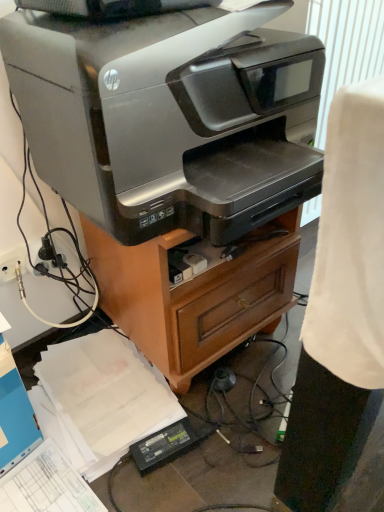
At what (x,y) coordinates should I click in order to perform the action: click on satin silver printer at center. Please return your answer as a coordinate pair (x, y). The height and width of the screenshot is (512, 384). Looking at the image, I should click on (169, 118).

This screenshot has height=512, width=384. What do you see at coordinates (51, 254) in the screenshot?
I see `black plastic plug at lower left` at bounding box center [51, 254].

What are the coordinates of `silver metallic printer at center` in the screenshot? It's located at (194, 295).

You are a GUI agent. You are given a task and a screenshot of the screen. Output one action in this format:
    pyautogui.click(x=<x>, y=<y>)
    Task: Click on the printer on the left of silver metallic printer at center
    
    Given the screenshot: What is the action you would take?
    pyautogui.click(x=169, y=118)

Which object is closer to the camera taking this photo, silver metallic printer at center or satin silver printer at center?

satin silver printer at center is closer to the camera.

In the scene shown: How distant is silver metallic printer at center from satin silver printer at center?

23.71 centimeters.

Considering the sizes of objects silver metallic printer at center and satin silver printer at center in the image provided, who is wider, silver metallic printer at center or satin silver printer at center?

satin silver printer at center.

In terms of height, does black plastic plug at lower left look taller or shorter compared to satin silver printer at center?

In the image, black plastic plug at lower left appears to be shorter than satin silver printer at center.

Is black plastic plug at lower left not close to satin silver printer at center?

black plastic plug at lower left is actually quite close to satin silver printer at center.

Does point (45, 240) come closer to viewer compared to point (163, 150)?

No, it is not.

From a real-world perspective, between black plastic plug at lower left and satin silver printer at center, who is vertically lower?

In real-world perspective, black plastic plug at lower left is lower.

From the image's perspective, which object appears higher, satin silver printer at center or silver metallic printer at center?

satin silver printer at center, from the image's perspective.

Considering the sizes of satin silver printer at center and silver metallic printer at center in the image, is satin silver printer at center taller or shorter than silver metallic printer at center?

Clearly, satin silver printer at center is shorter compared to silver metallic printer at center.

Which object is further away from the camera, satin silver printer at center or silver metallic printer at center?

silver metallic printer at center is behind.

What's the angular difference between satin silver printer at center and silver metallic printer at center's facing directions?

2.07 degrees separate the facing orientations of satin silver printer at center and silver metallic printer at center.

Considering the relative positions of silver metallic printer at center and black plastic plug at lower left in the image provided, is silver metallic printer at center in front of black plastic plug at lower left?

Yes, it is.

Can you see silver metallic printer at center touching black plastic plug at lower left?

No, silver metallic printer at center is not beside black plastic plug at lower left.

Does silver metallic printer at center turn towards black plastic plug at lower left?

No, silver metallic printer at center is not oriented towards black plastic plug at lower left.

Is silver metallic printer at center taller or shorter than black plastic plug at lower left?

silver metallic printer at center is taller than black plastic plug at lower left.

Could you tell me if black plastic plug at lower left is facing silver metallic printer at center?

No, black plastic plug at lower left is not facing towards silver metallic printer at center.

Which is closer to the camera, (42,259) or (119,281)?

The point (119,281) is closer.

Does black plastic plug at lower left have a smaller size compared to silver metallic printer at center?

Yes.

Looking at this image, is satin silver printer at center facing towards black plastic plug at lower left?

No, satin silver printer at center is not turned towards black plastic plug at lower left.

From a real-world perspective, which is physically below, satin silver printer at center or black plastic plug at lower left?

From a 3D spatial view, black plastic plug at lower left is below.

Can black plastic plug at lower left be found inside satin silver printer at center?

Definitely not — black plastic plug at lower left is not inside satin silver printer at center.

Considering the sizes of objects satin silver printer at center and black plastic plug at lower left in the image provided, who is bigger, satin silver printer at center or black plastic plug at lower left?

satin silver printer at center is bigger.

Image resolution: width=384 pixels, height=512 pixels. Find the location of `printer above the silver metallic printer at center (from the image's perspective)`. printer above the silver metallic printer at center (from the image's perspective) is located at coordinates (169, 118).

Find the location of a particular element. The height and width of the screenshot is (512, 384). plug below the satin silver printer at center (from the image's perspective) is located at coordinates (51, 254).

Based on their spatial positions, is silver metallic printer at center or black plastic plug at lower left further from satin silver printer at center?

The object further to satin silver printer at center is black plastic plug at lower left.

Considering their positions, is silver metallic printer at center positioned closer to black plastic plug at lower left than satin silver printer at center?

silver metallic printer at center is closer to black plastic plug at lower left.

Which object lies further to the anchor point silver metallic printer at center, black plastic plug at lower left or satin silver printer at center?

Among the two, black plastic plug at lower left is located further to silver metallic printer at center.

Estimate the real-world distances between objects in this image. Which object is closer to black plastic plug at lower left, satin silver printer at center or silver metallic printer at center?

Based on the image, silver metallic printer at center appears to be nearer to black plastic plug at lower left.

Looking at the image, which one is located closer to silver metallic printer at center, satin silver printer at center or black plastic plug at lower left?

satin silver printer at center is positioned closer to the anchor silver metallic printer at center.

Considering their positions, is black plastic plug at lower left positioned closer to satin silver printer at center than silver metallic printer at center?

Among the two, silver metallic printer at center is located nearer to satin silver printer at center.

Identify the location of furniture between satin silver printer at center and black plastic plug at lower left along the z-axis. (194, 295).